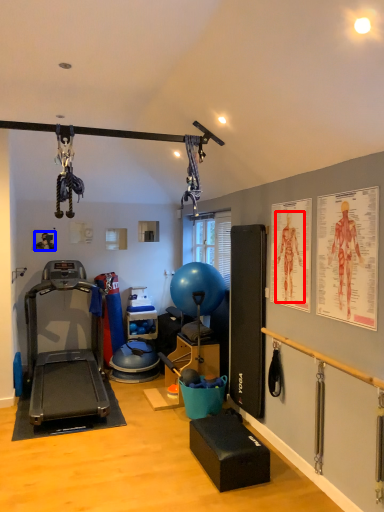
Question: Among these objects, which one is farthest to the camera, person (highlighted by a red box) or person (highlighted by a blue box)?

Choices:
 (A) person
 (B) person

Answer: (B)